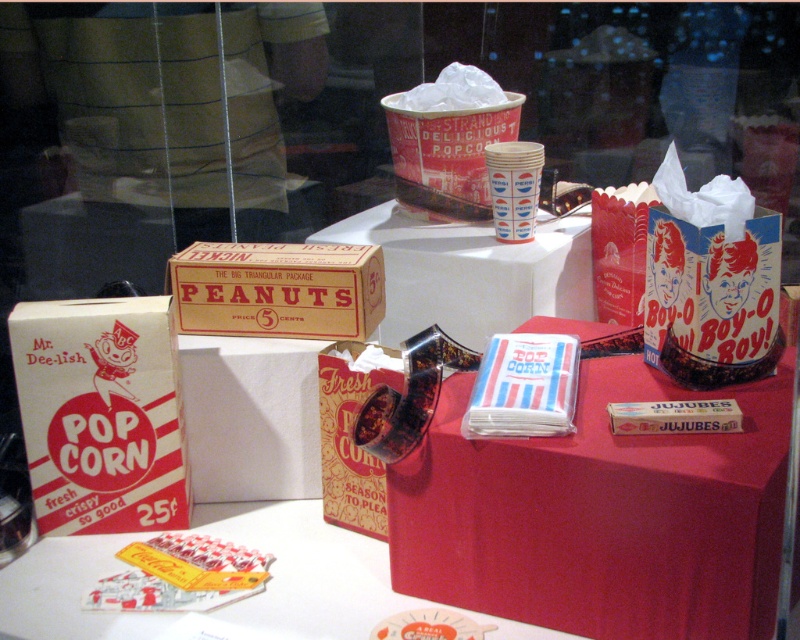
You are standing 1 meter away from the display. Can you reach the point at coordinates point (x=476, y=221) without moving closer?

The point at coordinates point (x=476, y=221) is 1.19 meters away from the viewer. Since you are standing 1 meter away, you are already closer than the point, so you can reach it without moving closer.

You are a museum visitor standing in front of the display. You notice the white paper table at lower center and the brown cardboard box at center. Which object is located lower in the scene?

The white paper table at lower center is located lower than the brown cardboard box at center.

You are a curator arranging a display of vintage snacks. You have a matte cardboard peanuts box at center and a brown cardboard box at center. Which box should you move to make space for a new exhibit piece that needs to be placed closer to the front? Explain your choice based on their current positions.

The matte cardboard peanuts box at center is closer to the front, so to make space for the new exhibit piece, you should move the brown cardboard box at center, which is further back, to create space in the front area.